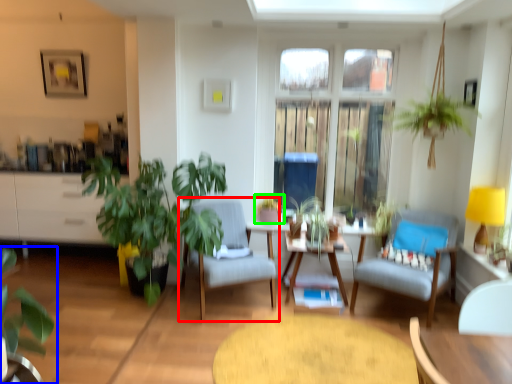
Question: Which object is positioned closest to chair (highlighted by a red box)? Select from houseplant (highlighted by a blue box) and houseplant (highlighted by a green box).

Choices:
 (A) houseplant
 (B) houseplant

Answer: (B)